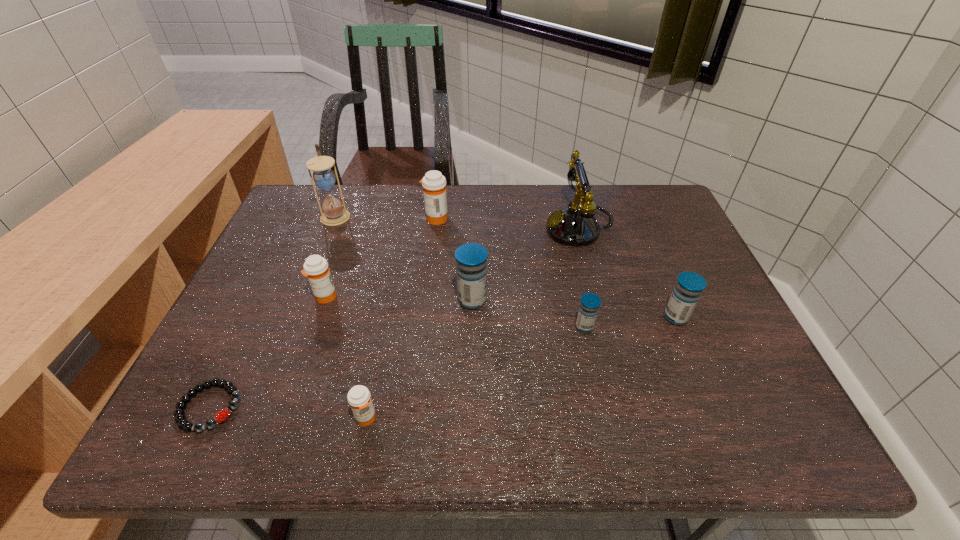
Locate which blue medicine is the closest to the rightmost object. Please provide its 2D coordinates. Your answer should be formatted as a tuple, i.e. [(x, y)], where the tuple contains the x and y coordinates of a point satisfying the conditions above.

[(589, 306)]

Where is `free region that satisfies the following two spatial constraints: 1. on the back side of the black bracelet; 2. on the right side of the leftmost medicine`? Image resolution: width=960 pixels, height=540 pixels. free region that satisfies the following two spatial constraints: 1. on the back side of the black bracelet; 2. on the right side of the leftmost medicine is located at coordinates (263, 297).

Locate an element on the screen. The image size is (960, 540). vacant space that satisfies the following two spatial constraints: 1. on the dial of the rightmost blue medicine; 2. on the right side of the black telephone is located at coordinates (603, 318).